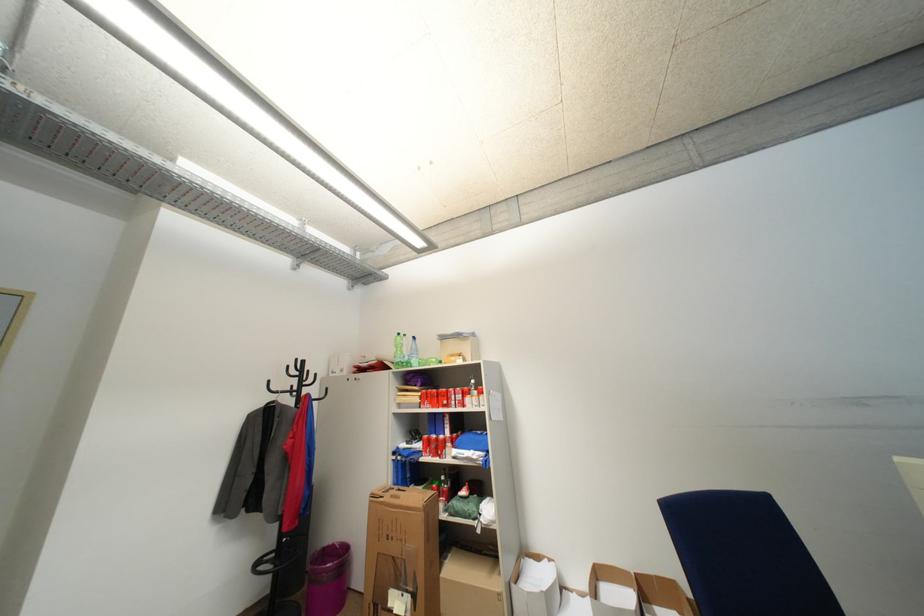
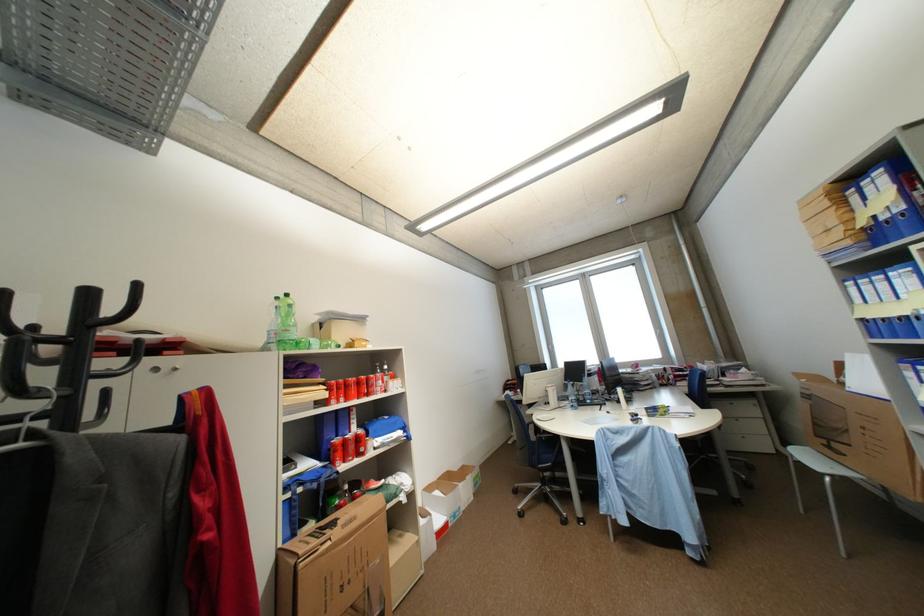
In the second image, find the point that corresponds to point (447, 448) in the first image.

(368, 447)